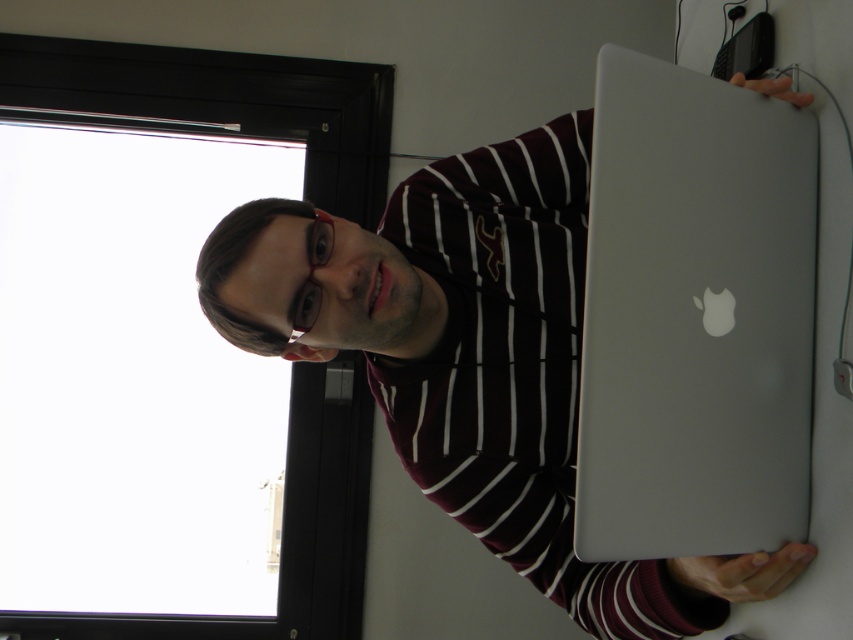
Is point (370, 340) farther from camera compared to point (679, 330)?

Yes.

Can you confirm if silver metallic laptop at upper right is positioned above sleek silver laptop at center?

Indeed, silver metallic laptop at upper right is positioned over sleek silver laptop at center.

Between point (547, 548) and point (613, 296), which one is positioned behind?

The point (547, 548) is behind.

Where is `silver metallic laptop at upper right`? The height and width of the screenshot is (640, 853). silver metallic laptop at upper right is located at coordinates (473, 358).